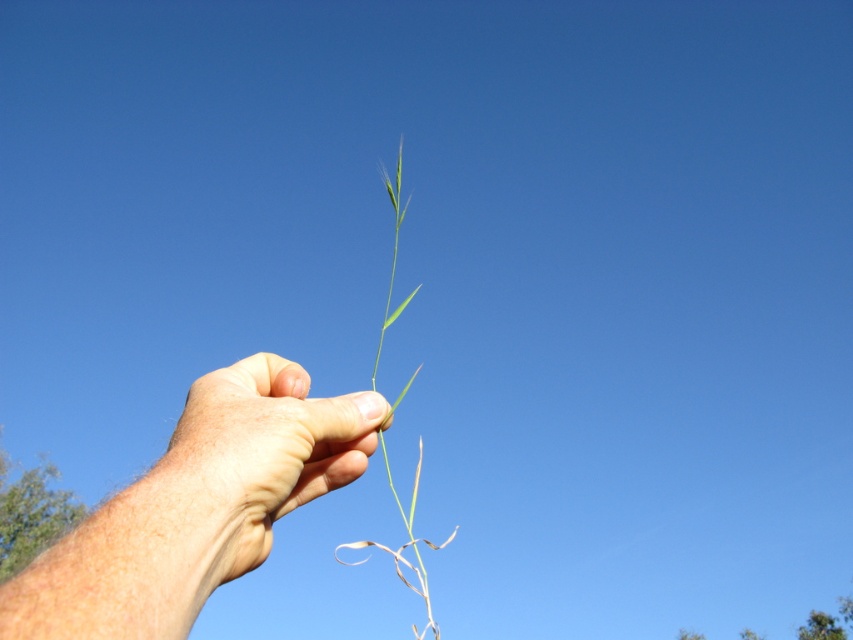
You are an artist trying to draw the grass stalk in the image. The grass stalk has a point at coordinate (196,506). Where exactly on the grass stalk is this point located?

The point at coordinate (196,506) is located on the skinny green stem at center of the grass stalk.

You are a photographer trying to capture a close up of the skinny green leaf at center. You want to ensure that the leaf is in focus while the background remains blurred. Based on the scene description, what is the minimum distance you should set your camera lens to focus on to achieve this effect?

The skinny green leaf at center is 32.01 centimeters away from the viewer. To ensure the leaf is in focus while blurring the background, the camera lens should be set to focus at 32.01 centimeters.

You are an artist sketching the hand holding the grass. You want to draw the skinny green stem at center and the skinny green leaf at center accurately. Which one should you draw first to maintain perspective?

You should draw the skinny green stem at center first because it is closer to the viewer than the skinny green leaf at center, so it should be placed in front in your sketch.